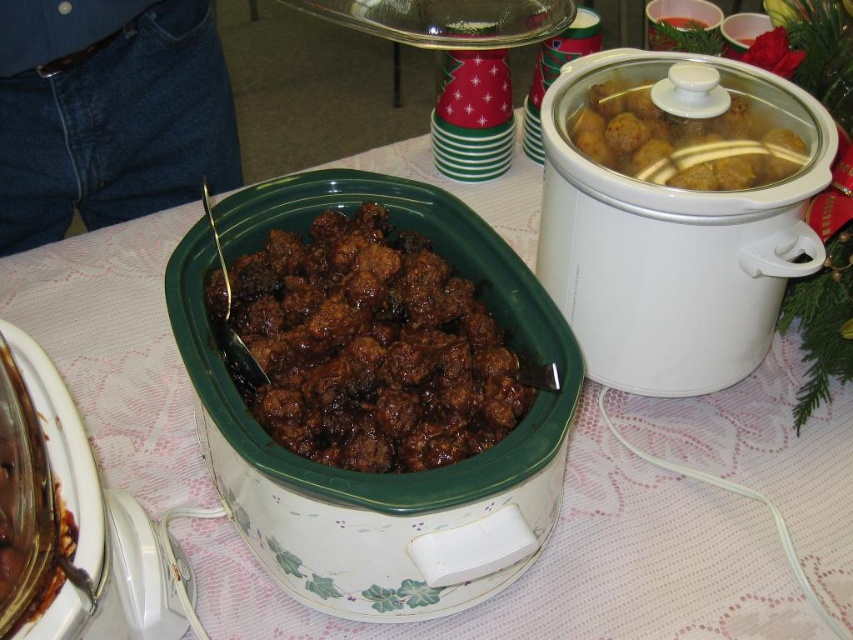
Question: Which is nearer to the white glossy crock pot at center?

Choices:
 (A) translucent glass meatballs at center
 (B) brown glossy meatballs at center
 (C) white glossy slow cooker at center

Answer: (B)

Question: Which of the following is the farthest from the observer?

Choices:
 (A) (19, 636)
 (B) (677, 161)
 (C) (264, 528)

Answer: (B)

Question: Which of the following is the farthest from the observer?

Choices:
 (A) white glossy crock pot at center
 (B) translucent glass meatballs at center
 (C) brown glossy meatballs at center
 (D) white matte slow cooker at center right

Answer: (B)

Question: Is white glossy slow cooker at center above translucent glass meatballs at center?

Choices:
 (A) yes
 (B) no

Answer: (B)

Question: In this image, where is white glossy crock pot at center located relative to brown glossy meatballs at center?

Choices:
 (A) below
 (B) above

Answer: (A)

Question: Is white glossy slow cooker at center below translucent glass meatballs at center?

Choices:
 (A) yes
 (B) no

Answer: (A)